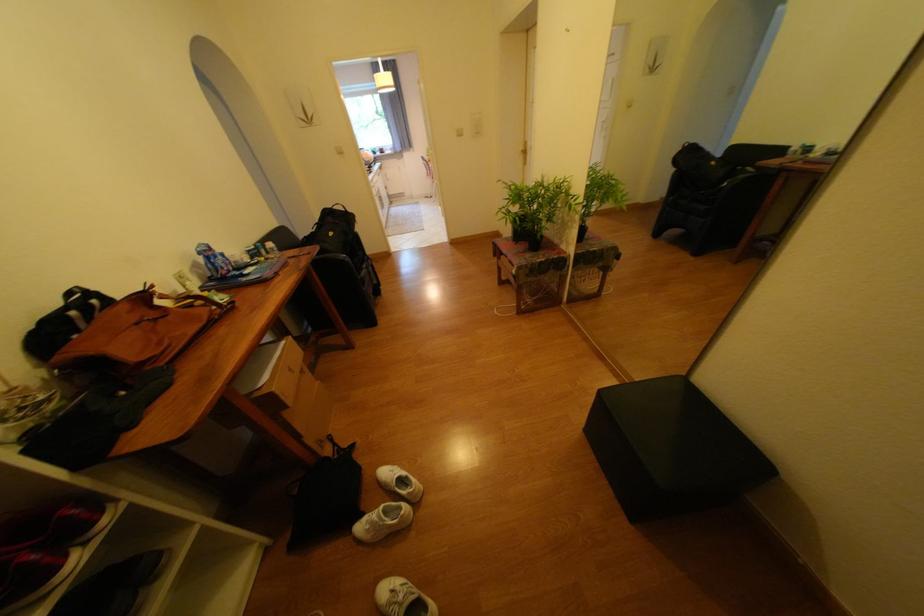
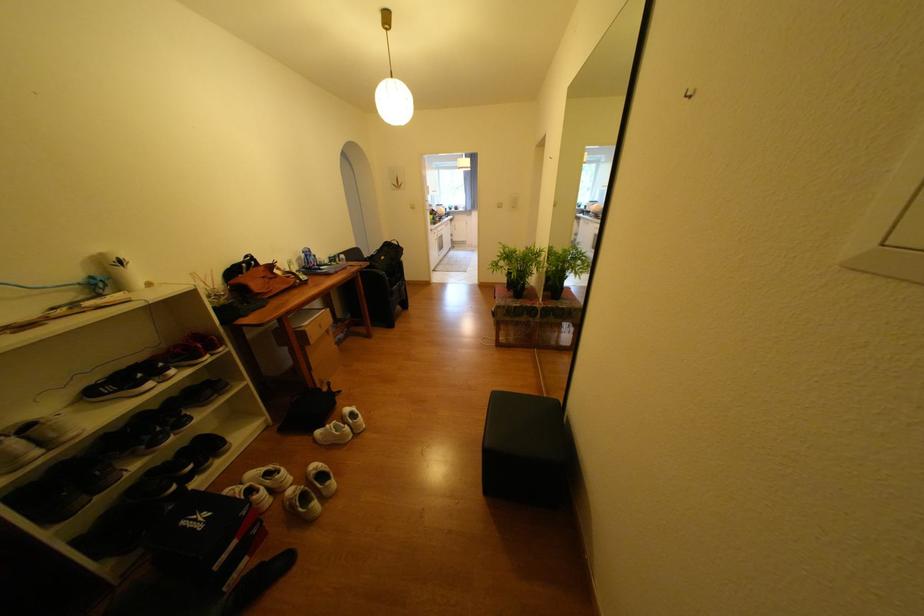
Locate, in the second image, the point that corresponds to point 531,246 in the first image.

(520, 294)